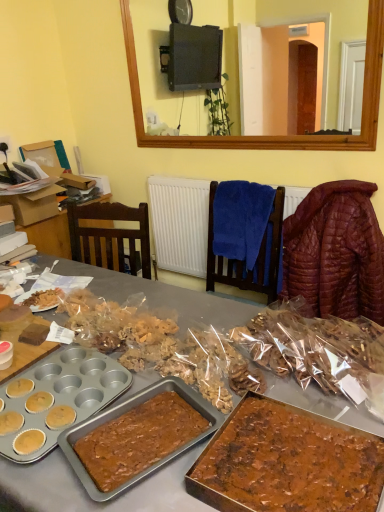
Question: Is the depth of chocolatey brown cake at lower right greater than that of translucent plastic cookies at center, the second snack when ordered from left to right?

Choices:
 (A) yes
 (B) no

Answer: (B)

Question: Can you confirm if chocolatey brown cake at lower right is thinner than translucent plastic cookies at center, arranged as the 1th snack when viewed from the right?

Choices:
 (A) yes
 (B) no

Answer: (A)

Question: Can you confirm if chocolatey brown cake at lower right is shorter than translucent plastic cookies at center, the second snack when ordered from left to right?

Choices:
 (A) yes
 (B) no

Answer: (A)

Question: Would you say chocolatey brown cake at lower right is outside translucent plastic cookies at center, arranged as the 1th snack when viewed from the right?

Choices:
 (A) yes
 (B) no

Answer: (A)

Question: Considering the relative sizes of chocolatey brown cake at lower right and translucent plastic cookies at center, arranged as the 1th snack when viewed from the right, in the image provided, is chocolatey brown cake at lower right wider than translucent plastic cookies at center, arranged as the 1th snack when viewed from the right,?

Choices:
 (A) yes
 (B) no

Answer: (B)

Question: Visually, is blue fabric chair at center positioned to the left or to the right of cardboard box at left?

Choices:
 (A) left
 (B) right

Answer: (B)

Question: Do you think blue fabric chair at center is within cardboard box at left, or outside of it?

Choices:
 (A) inside
 (B) outside

Answer: (B)

Question: Based on their sizes in the image, would you say blue fabric chair at center is bigger or smaller than cardboard box at left?

Choices:
 (A) big
 (B) small

Answer: (B)

Question: Considering the positions of point (210, 279) and point (24, 204), is point (210, 279) closer or farther from the camera than point (24, 204)?

Choices:
 (A) closer
 (B) farther

Answer: (B)

Question: Based on their sizes in the image, would you say blue fabric chair at center is bigger or smaller than quilted brown jacket at right?

Choices:
 (A) small
 (B) big

Answer: (A)

Question: From the image's perspective, is blue fabric chair at center located above or below quilted brown jacket at right?

Choices:
 (A) above
 (B) below

Answer: (A)

Question: Is blue fabric chair at center in front of or behind quilted brown jacket at right in the image?

Choices:
 (A) front
 (B) behind

Answer: (B)

Question: From a real-world perspective, is blue fabric chair at center physically located above or below quilted brown jacket at right?

Choices:
 (A) above
 (B) below

Answer: (A)

Question: In the image, is translucent plastic bag at center, placed as the first snack when sorted from left to right, positioned in front of or behind quilted brown jacket at right?

Choices:
 (A) front
 (B) behind

Answer: (A)

Question: Is translucent plastic bag at center, placed as the first snack when sorted from left to right, inside or outside of quilted brown jacket at right?

Choices:
 (A) outside
 (B) inside

Answer: (A)